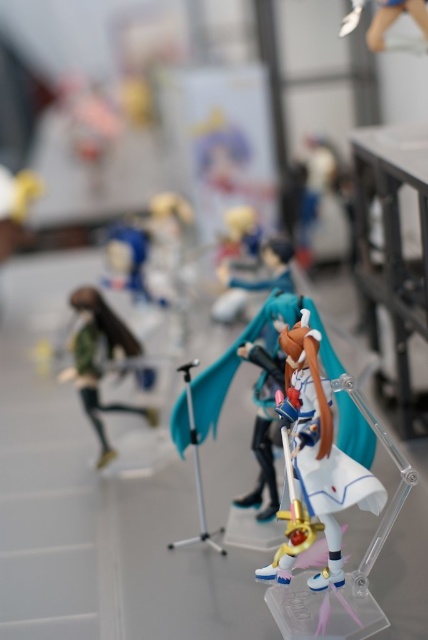
You are an art curator planning to place a new figurine on the display. The existing display has a satin white figurine at center. Where would you place the new figurine to avoid overlapping with the existing one? Please provide coordinates in the format of point like point (321, 445).

The point (321, 445) is on the satin white figurine at center, so placing the new figurine at a different coordinate such as point 0.3, 0.4 would avoid overlapping.

You are a photographer at the exhibition and want to adjust the lighting so that the area closer to the camera is brighter. Which of the two points, point (329, 564) or point (82, 339), should you focus the light on?

Point (329, 564) is closer to the camera than point (82, 339), so you should focus the light on point (329, 564) to make the closer area brighter.